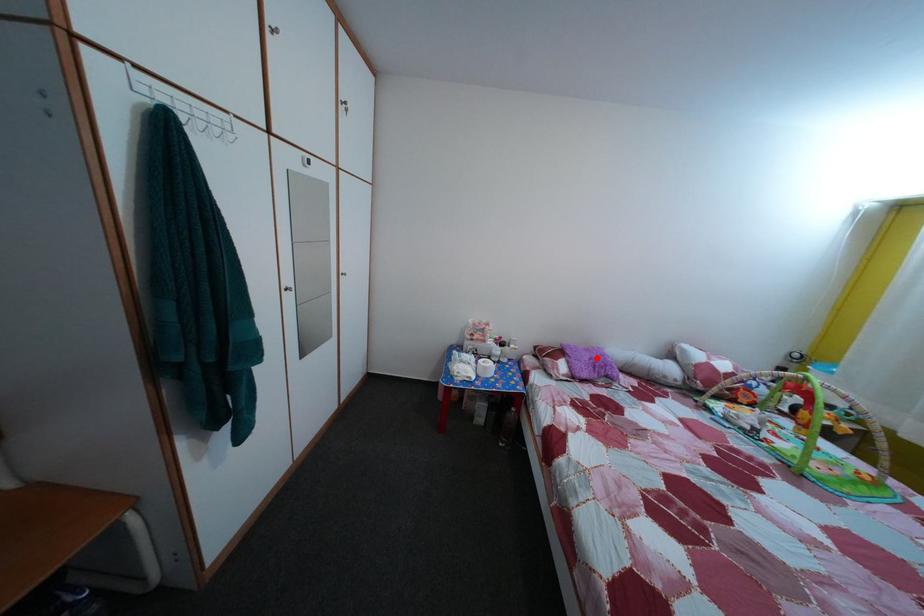
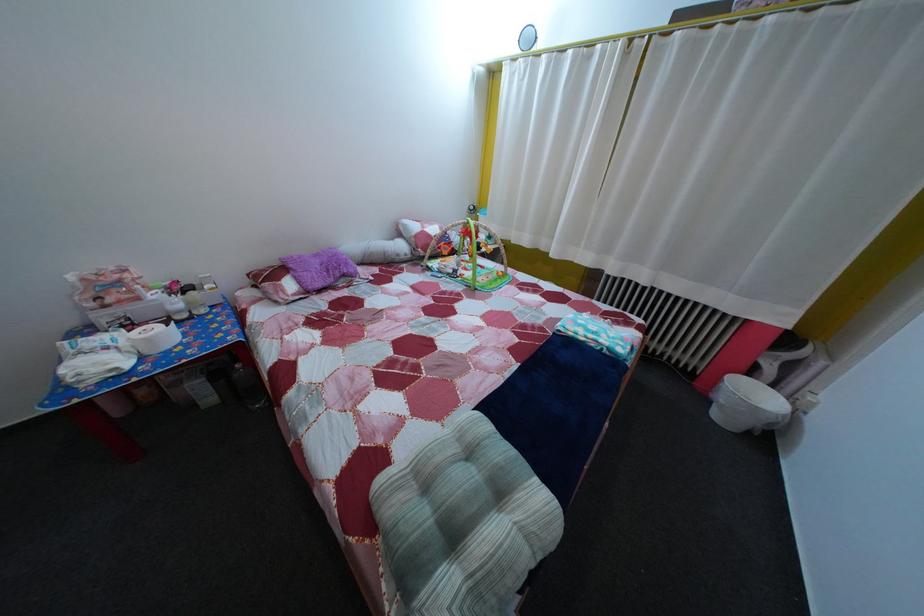
Question: A red point is marked in image1. In image2, is the corresponding 3D point closer to the camera or farther? Reply with the corresponding letter.

Choices:
 (A) The corresponding 3D point is closer.
 (B) The corresponding 3D point is farther.

Answer: (A)